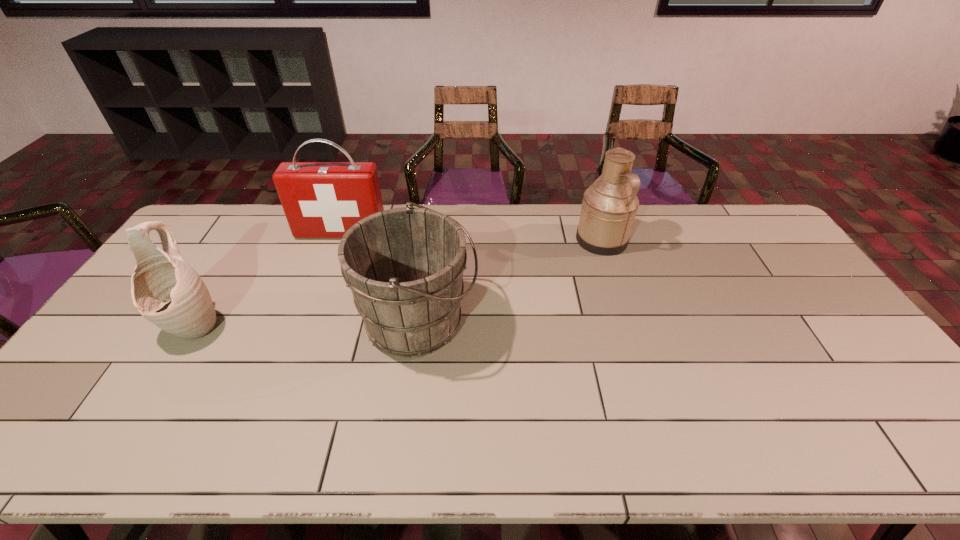
The image size is (960, 540). I want to click on the first-aid kit, so click(x=320, y=199).

Locate an element on the screen. The width and height of the screenshot is (960, 540). the farther pitcher is located at coordinates (609, 206).

What are the coordinates of `the rightmost object` in the screenshot? It's located at coord(609,206).

At what (x,y) coordinates should I click in order to perform the action: click on the left pitcher. Please return your answer as a coordinate pair (x, y). Looking at the image, I should click on [x=165, y=289].

The width and height of the screenshot is (960, 540). In order to click on the nearer pitcher in this screenshot , I will do `click(165, 289)`.

This screenshot has width=960, height=540. Find the location of `bucket`. bucket is located at coordinates (404, 266).

Find the location of a particular element. vacant space located 0.160m on the front face of the first-aid kit is located at coordinates (326, 272).

Where is `vacant region located 0.380m on the left of the right pitcher`? vacant region located 0.380m on the left of the right pitcher is located at coordinates (467, 240).

The image size is (960, 540). I want to click on free space located 0.060m at the spout of the left pitcher, so click(x=167, y=370).

At what (x,y) coordinates should I click in order to perform the action: click on free region located 0.360m on the handle side of the bucket. Please return your answer as a coordinate pair (x, y). The width and height of the screenshot is (960, 540). Looking at the image, I should click on (605, 321).